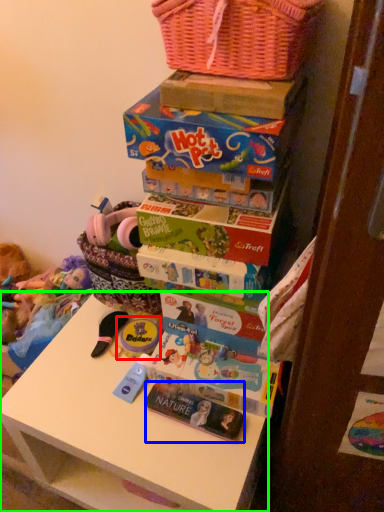
Question: Which is farther away from toy (highlighted by a red box)? magazine (highlighted by a blue box) or table (highlighted by a green box)?

Choices:
 (A) magazine
 (B) table

Answer: (B)